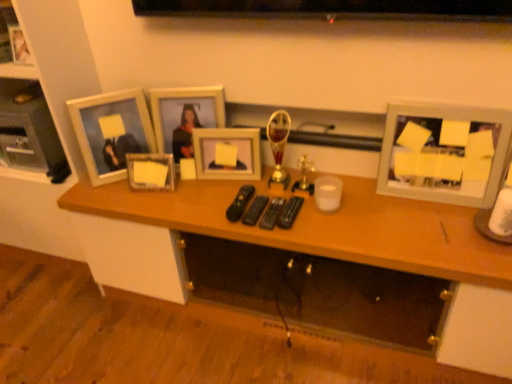
The width and height of the screenshot is (512, 384). I want to click on vacant region to the left of black plastic remote at center, positioned as the 1th remote control in left-to-right order, so click(x=197, y=202).